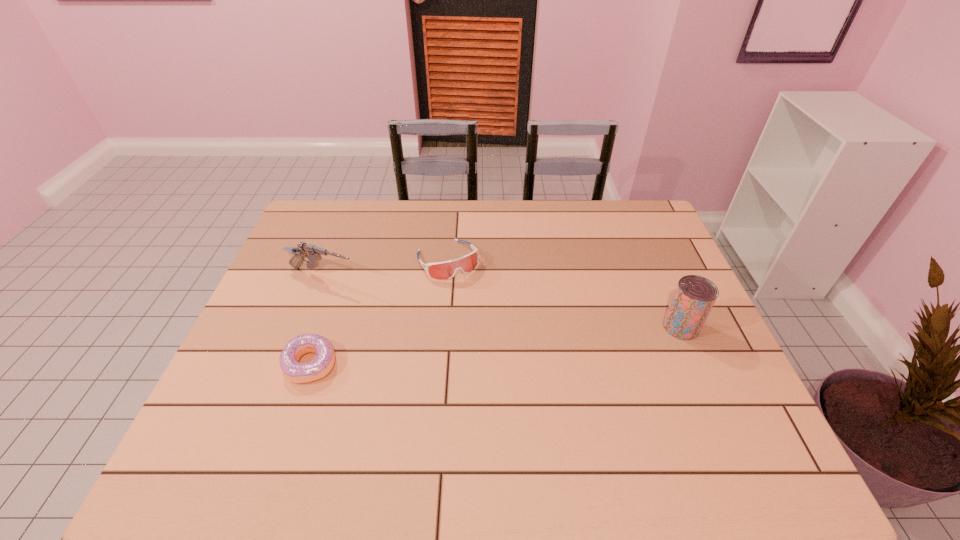
This screenshot has width=960, height=540. I want to click on blank space located 0.280m at the barrel of the third shortest object, so click(x=440, y=309).

Where is `vacant point located at the barrel of the third shortest object`? This screenshot has width=960, height=540. vacant point located at the barrel of the third shortest object is located at coordinates (443, 310).

Identify the location of vacant region located on the front-facing side of the second object from right to left. (470, 298).

The image size is (960, 540). I want to click on vacant space located on the front-facing side of the second object from right to left, so click(x=470, y=298).

This screenshot has width=960, height=540. What are the coordinates of `free region located on the front-facing side of the second object from right to left` in the screenshot? It's located at (514, 366).

Find the location of `object located at the far edge`. object located at the far edge is located at coordinates (441, 270).

You are a GUI agent. You are given a task and a screenshot of the screen. Output one action in this format:
    pyautogui.click(x=<x>, y=<y>)
    Task: Click on the doughnut present at the left edge
    The image size is (960, 540).
    Given the screenshot: What is the action you would take?
    pyautogui.click(x=295, y=372)

In order to click on gun at the left edge in this screenshot , I will do `click(313, 253)`.

Find the location of `object that is at the right edge`. object that is at the right edge is located at coordinates (694, 297).

I want to click on free space at the far edge of the desktop, so click(x=400, y=219).